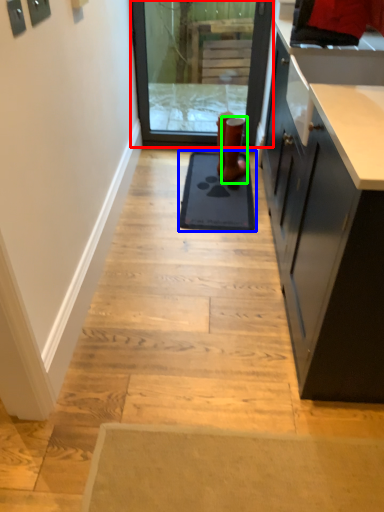
Question: Estimate the real-world distances between objects in this image. Which object is farther from screen door (highlighted by a red box), mat (highlighted by a blue box) or footwear (highlighted by a green box)?

Choices:
 (A) mat
 (B) footwear

Answer: (A)